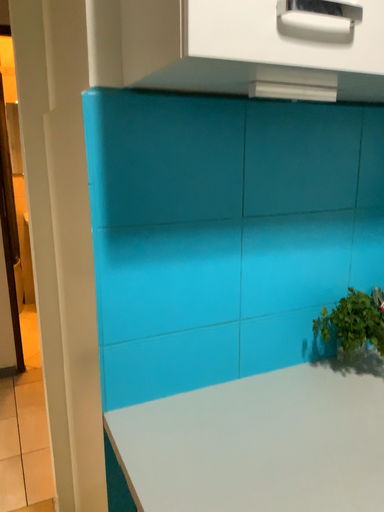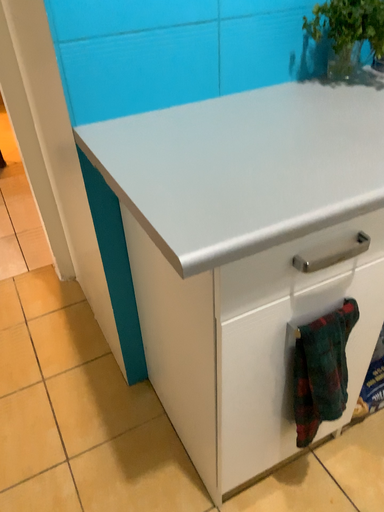
Question: Which way did the camera rotate in the video?

Choices:
 (A) rotated downward
 (B) rotated upward

Answer: (A)